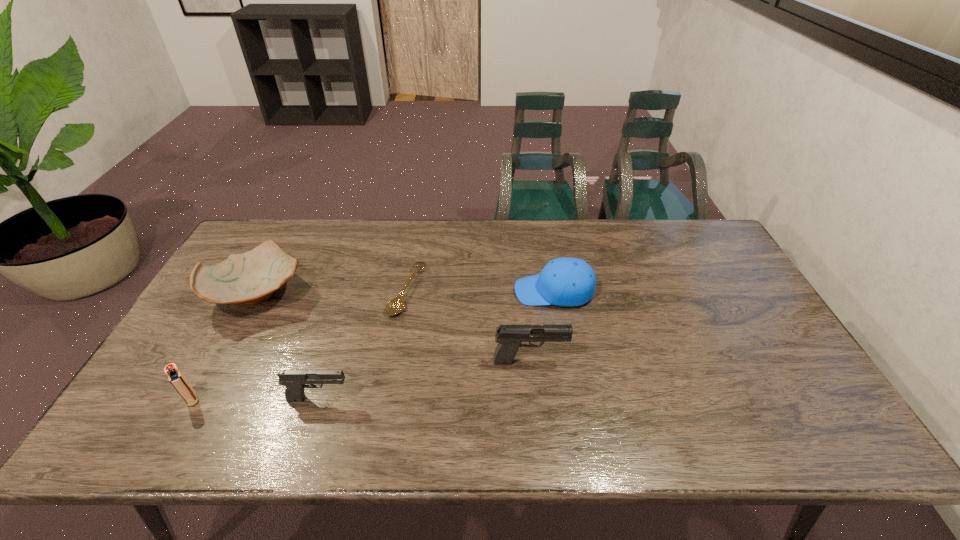
Please point a vacant point for placing a pistol on the right. Please provide its 2D coordinates. Your answer should be formatted as a tuple, i.e. [(x, y)], where the tuple contains the x and y coordinates of a point satisfying the conditions above.

[(711, 328)]